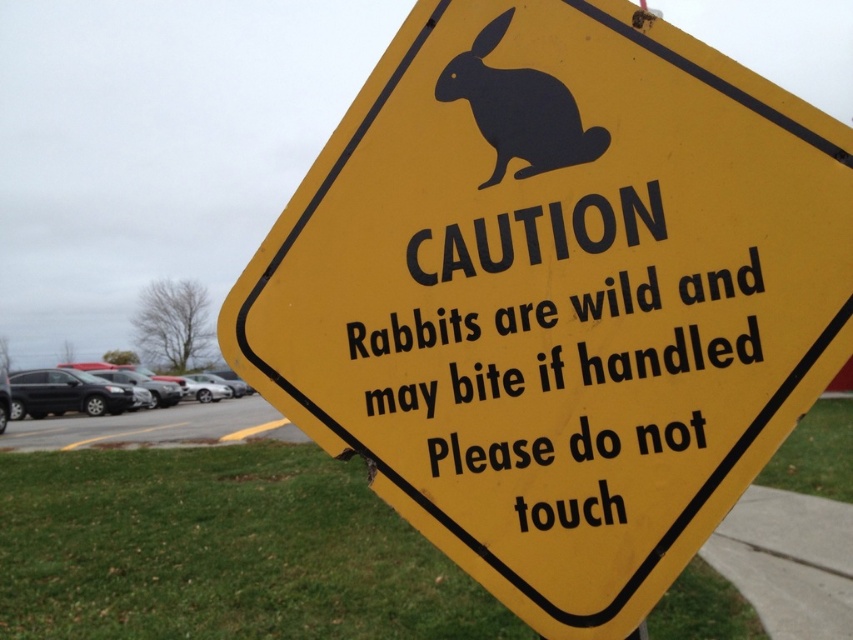
Which is more to the left, yellow plastic sign at center or black matte rabbit at upper center?

yellow plastic sign at center is more to the left.

Is point (392, 296) positioned in front of point (543, 109)?

No, (392, 296) is further to viewer.

Where is `yellow plastic sign at center`? yellow plastic sign at center is located at coordinates (556, 294).